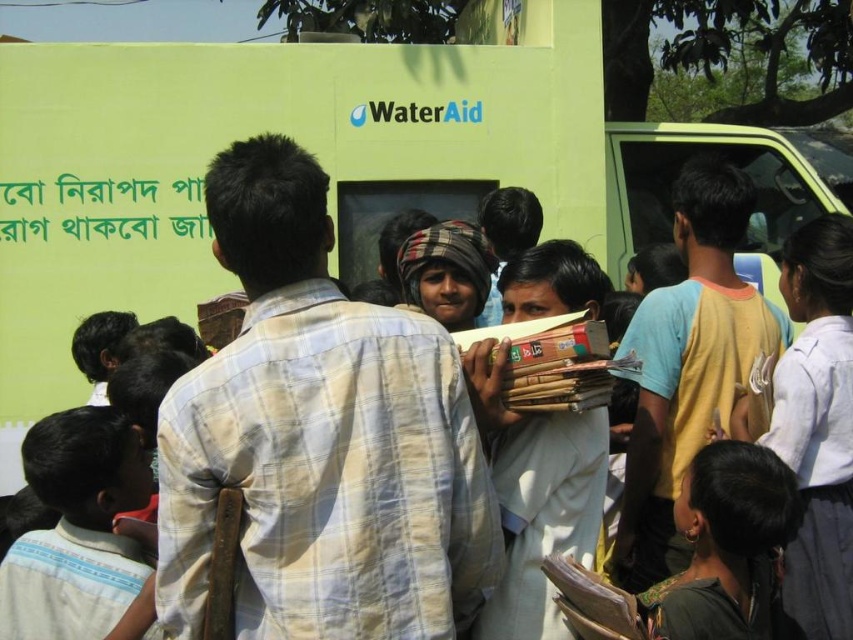
The height and width of the screenshot is (640, 853). What do you see at coordinates (320, 438) in the screenshot? I see `light beige plaid shirt at center` at bounding box center [320, 438].

Find the location of a particular element. The image size is (853, 640). light beige plaid shirt at center is located at coordinates (320, 438).

What do you see at coordinates (320, 438) in the screenshot? The width and height of the screenshot is (853, 640). I see `light beige plaid shirt at center` at bounding box center [320, 438].

The height and width of the screenshot is (640, 853). I want to click on light beige plaid shirt at center, so click(x=320, y=438).

Between light beige plaid shirt at center and dark brown fabric headscarf at lower right, which one is positioned higher?

light beige plaid shirt at center is higher up.

How far apart are light beige plaid shirt at center and dark brown fabric headscarf at lower right?

light beige plaid shirt at center and dark brown fabric headscarf at lower right are 6.72 feet apart from each other.

Is point (294, 481) positioned after point (692, 611)?

No.

You are a GUI agent. You are given a task and a screenshot of the screen. Output one action in this format:
    pyautogui.click(x=<x>, y=<y>)
    Task: Click on the light beige plaid shirt at center
    Image resolution: width=853 pixels, height=640 pixels.
    Given the screenshot: What is the action you would take?
    pyautogui.click(x=320, y=438)

Does white cotton shirt at lower left have a smaller size compared to dark brown fabric headscarf at lower right?

Actually, white cotton shirt at lower left might be larger than dark brown fabric headscarf at lower right.

Does white cotton shirt at lower left appear under dark brown fabric headscarf at lower right?

No.

Does point (45, 419) come closer to viewer compared to point (770, 536)?

No, (45, 419) is further to viewer.

The width and height of the screenshot is (853, 640). Identify the location of white cotton shirt at lower left. (76, 529).